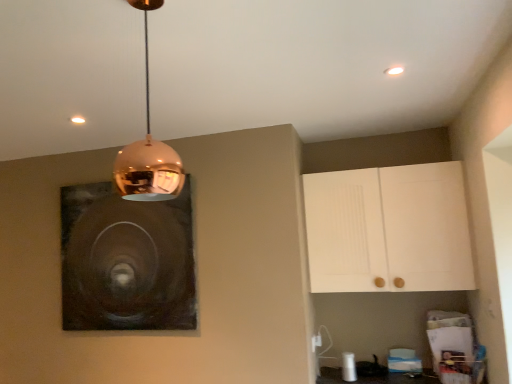
Question: Which direction should I rotate to look at copper reflective pendant light at upper center?

Choices:
 (A) right
 (B) left

Answer: (B)

Question: From a real-world perspective, is white matte cabinet at upper right positioned over copper reflective pendant light at upper center based on gravity?

Choices:
 (A) yes
 (B) no

Answer: (B)

Question: Considering the relative sizes of white matte cabinet at upper right and copper reflective pendant light at upper center in the image provided, is white matte cabinet at upper right thinner than copper reflective pendant light at upper center?

Choices:
 (A) yes
 (B) no

Answer: (B)

Question: Does white matte cabinet at upper right have a lesser height compared to copper reflective pendant light at upper center?

Choices:
 (A) no
 (B) yes

Answer: (A)

Question: Can you confirm if white matte cabinet at upper right is bigger than copper reflective pendant light at upper center?

Choices:
 (A) no
 (B) yes

Answer: (B)

Question: Does white matte cabinet at upper right have a greater height compared to copper reflective pendant light at upper center?

Choices:
 (A) no
 (B) yes

Answer: (B)

Question: Considering the relative positions of white matte cabinet at upper right and copper reflective pendant light at upper center in the image provided, is white matte cabinet at upper right to the right of copper reflective pendant light at upper center from the viewer's perspective?

Choices:
 (A) no
 (B) yes

Answer: (B)

Question: Would you say copper reflective pendant light at upper center contains dark matte painting at upper left?

Choices:
 (A) yes
 (B) no

Answer: (B)

Question: From the image's perspective, is copper reflective pendant light at upper center beneath dark matte painting at upper left?

Choices:
 (A) no
 (B) yes

Answer: (A)

Question: Is the depth of copper reflective pendant light at upper center greater than that of dark matte painting at upper left?

Choices:
 (A) yes
 (B) no

Answer: (B)

Question: From a real-world perspective, is copper reflective pendant light at upper center over dark matte painting at upper left?

Choices:
 (A) yes
 (B) no

Answer: (A)

Question: Considering the relative sizes of copper reflective pendant light at upper center and dark matte painting at upper left in the image provided, is copper reflective pendant light at upper center shorter than dark matte painting at upper left?

Choices:
 (A) yes
 (B) no

Answer: (A)

Question: Is copper reflective pendant light at upper center next to dark matte painting at upper left and touching it?

Choices:
 (A) yes
 (B) no

Answer: (B)

Question: From the image's perspective, would you say white matte cabinet at upper right is positioned over dark matte painting at upper left?

Choices:
 (A) yes
 (B) no

Answer: (A)